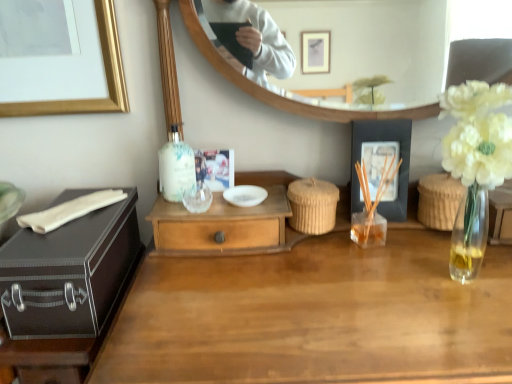
Locate an element on the screen. empty space that is ontop of matte black suitcase at left (from a real-world perspective) is located at coordinates (67, 214).